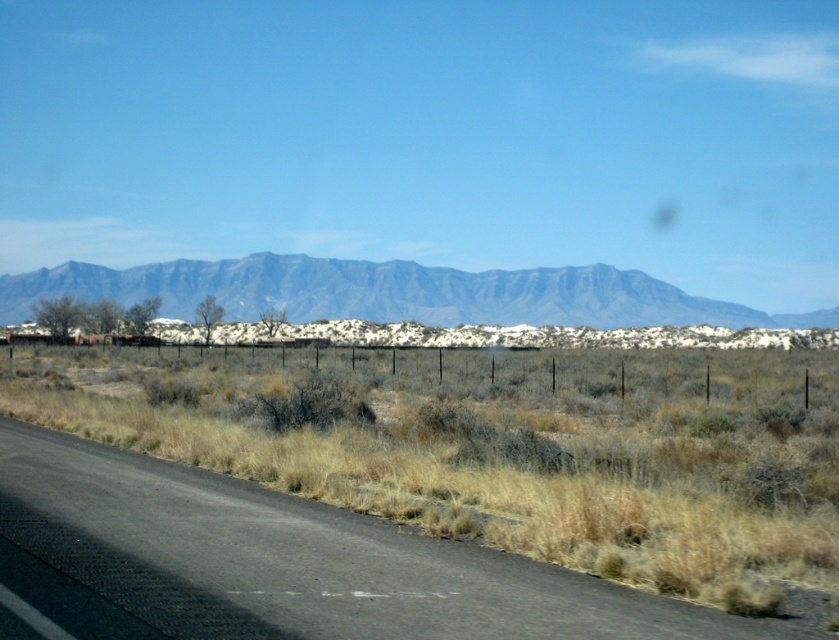
From the picture: You are a hiker standing on the paved road and looking towards the gray matte mountain range at center. There is dry grass at lower center in front of you. Which object is closer to you?

The dry grass at lower center is closer to you since it is positioned in front of the gray matte mountain range at center.